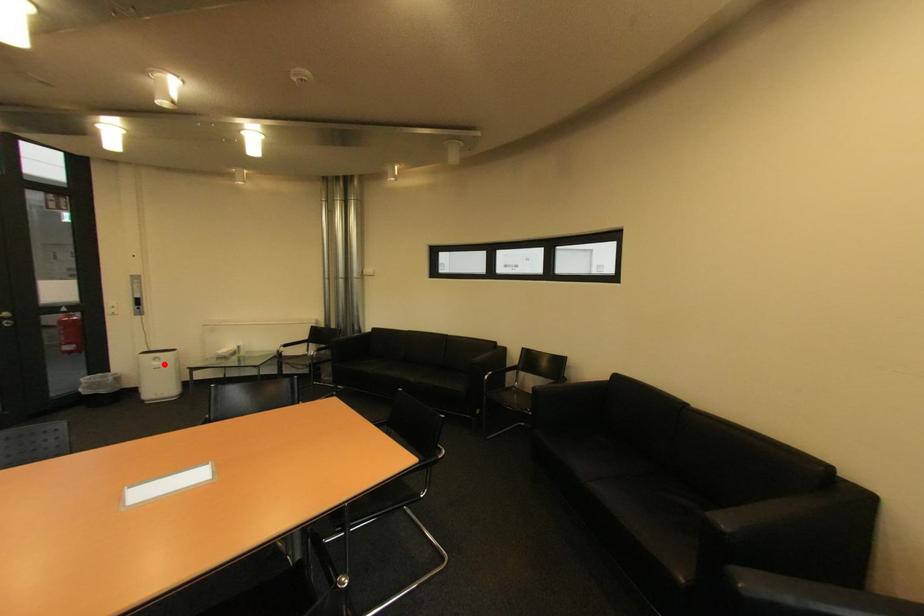
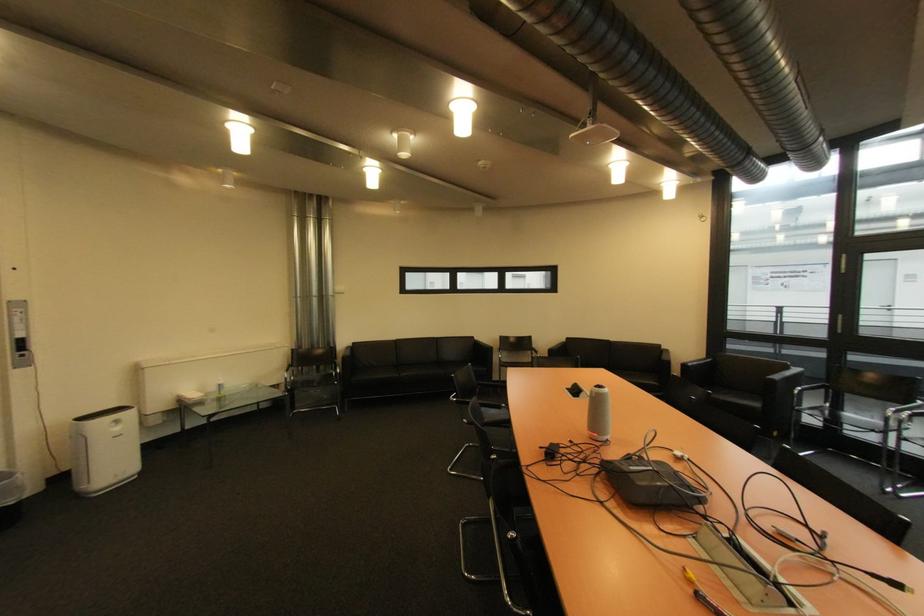
In the second image, find the point that corresponds to the highlighted location in the first image.

(124, 430)